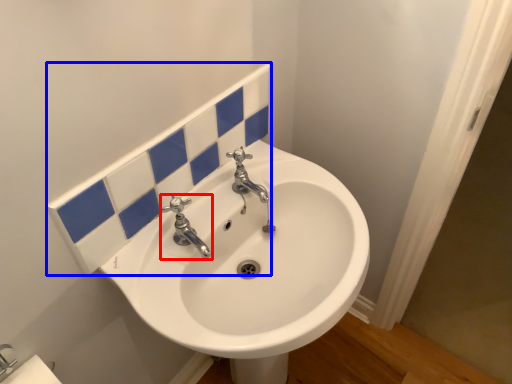
Question: Which point is further to the camera, tap (highlighted by a red box) or tile (highlighted by a blue box)?

Choices:
 (A) tap
 (B) tile

Answer: (A)